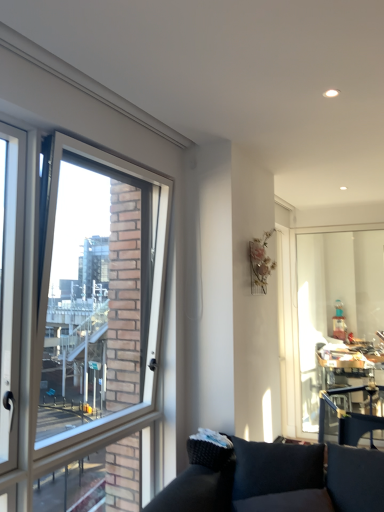
Find the location of a particular element. This screenshot has height=512, width=384. clear glass window at left is located at coordinates (122, 157).

The image size is (384, 512). What do you see at coordinates (122, 157) in the screenshot?
I see `clear glass window at left` at bounding box center [122, 157].

Describe the element at coordinates (339, 314) in the screenshot. I see `transparent glass window screen at right` at that location.

What are the coordinates of `transparent glass window screen at right` in the screenshot? It's located at (x=339, y=314).

Where is `clear glass window at left`? Image resolution: width=384 pixels, height=512 pixels. clear glass window at left is located at coordinates point(122,157).

Is transparent glass window screen at right to the left of clear glass window at left from the viewer's perspective?

No, transparent glass window screen at right is not to the left of clear glass window at left.

Does transparent glass window screen at right lie in front of clear glass window at left?

No, transparent glass window screen at right is further to the viewer.

Which is behind, point (353, 353) or point (77, 78)?

Positioned behind is point (353, 353).

From the image's perspective, would you say transparent glass window screen at right is shown under clear glass window at left?

Yes, from the image's perspective, transparent glass window screen at right is beneath clear glass window at left.

From a real-world perspective, between transparent glass window screen at right and clear glass window at left, who is vertically higher?

In real-world perspective, clear glass window at left is above.

Considering the sizes of objects transparent glass window screen at right and clear glass window at left in the image provided, who is wider, transparent glass window screen at right or clear glass window at left?

clear glass window at left is wider.

Who is taller, transparent glass window screen at right or clear glass window at left?

clear glass window at left is taller.

Consider the image. Between transparent glass window screen at right and clear glass window at left, which one has larger size?

With larger size is clear glass window at left.

Would you say clear glass window at left is part of transparent glass window screen at right's contents?

No, transparent glass window screen at right does not contain clear glass window at left.

Is transparent glass window screen at right far from clear glass window at left?

transparent glass window screen at right is positioned a significant distance from clear glass window at left.

Is transparent glass window screen at right facing towards clear glass window at left?

Yes, transparent glass window screen at right is aimed at clear glass window at left.

Measure the distance between transparent glass window screen at right and clear glass window at left.

transparent glass window screen at right and clear glass window at left are 10.68 feet apart.

At what (x,y) coordinates should I click in order to perform the action: click on window screen below the clear glass window at left (from the image's perspective). Please return your answer as a coordinate pair (x, y). Looking at the image, I should click on (339, 314).

Looking at this image, between clear glass window at left and transparent glass window screen at right, which one appears on the left side from the viewer's perspective?

From the viewer's perspective, clear glass window at left appears more on the left side.

Does clear glass window at left lie behind transparent glass window screen at right?

No.

Which is farther, (50, 119) or (374, 253)?

The point (374, 253) is farther.

From the image's perspective, is clear glass window at left above or below transparent glass window screen at right?

clear glass window at left is above transparent glass window screen at right.

From a real-world perspective, relative to transparent glass window screen at right, is clear glass window at left vertically above or below?

In terms of real-world spatial position, clear glass window at left is above transparent glass window screen at right.

Considering the relative sizes of clear glass window at left and transparent glass window screen at right in the image provided, is clear glass window at left wider than transparent glass window screen at right?

Yes, clear glass window at left is wider than transparent glass window screen at right.

Which of these two, clear glass window at left or transparent glass window screen at right, stands taller?

clear glass window at left is taller.

Consider the image. Based on their sizes in the image, would you say clear glass window at left is bigger or smaller than transparent glass window screen at right?

Considering their sizes, clear glass window at left takes up more space than transparent glass window screen at right.

Is transparent glass window screen at right a part of clear glass window at left?

That's incorrect, transparent glass window screen at right is not inside clear glass window at left.

Is clear glass window at left next to transparent glass window screen at right and touching it?

No, clear glass window at left is not touching transparent glass window screen at right.

Is clear glass window at left facing away from transparent glass window screen at right?

That's not correct — clear glass window at left is not looking away from transparent glass window screen at right.

The height and width of the screenshot is (512, 384). In order to click on window screen below the clear glass window at left (from a real-world perspective) in this screenshot , I will do `click(339, 314)`.

You are a GUI agent. You are given a task and a screenshot of the screen. Output one action in this format:
    pyautogui.click(x=<x>, y=<y>)
    Task: Click on the window on the left of transparent glass window screen at right
    The image size is (384, 512).
    Given the screenshot: What is the action you would take?
    pyautogui.click(x=122, y=157)

You are a GUI agent. You are given a task and a screenshot of the screen. Output one action in this format:
    pyautogui.click(x=<x>, y=<y>)
    Task: Click on the window located in front of the transparent glass window screen at right
    The image size is (384, 512).
    Given the screenshot: What is the action you would take?
    pyautogui.click(x=122, y=157)